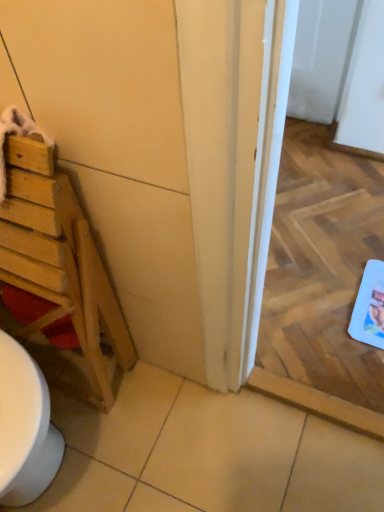
Image resolution: width=384 pixels, height=512 pixels. What do you see at coordinates (57, 265) in the screenshot? I see `wooden ladder at left` at bounding box center [57, 265].

The image size is (384, 512). Describe the element at coordinates (318, 402) in the screenshot. I see `white glossy screen door at center` at that location.

The width and height of the screenshot is (384, 512). Describe the element at coordinates (157, 156) in the screenshot. I see `wooden door at left` at that location.

The height and width of the screenshot is (512, 384). What are the coordinates of `wooden ladder at left` in the screenshot? It's located at (57, 265).

From the picture: Is white glossy screen door at center to the right of wooden door at left from the viewer's perspective?

Yes, white glossy screen door at center is to the right of wooden door at left.

Which of these two, white glossy screen door at center or wooden door at left, stands shorter?

Standing shorter between the two is white glossy screen door at center.

From the image's perspective, is white glossy screen door at center on top of wooden door at left?

Indeed, from the image's perspective, white glossy screen door at center is shown above wooden door at left.

Identify the location of door located below the white glossy screen door at center (from the image's perspective). (157, 156).

From a real-world perspective, does wooden door at left sit lower than wooden ladder at left?

No, from a real-world perspective, wooden door at left is not below wooden ladder at left.

What are the coordinates of `furniture on the left side of wooden door at left` in the screenshot? It's located at (57, 265).

How many degrees apart are the facing directions of wooden door at left and wooden ladder at left?

The angle between the facing direction of wooden door at left and the facing direction of wooden ladder at left is 90.3 degrees.

From the image's perspective, is wooden door at left over white glossy screen door at center?

No, from the image's perspective, wooden door at left is not on top of white glossy screen door at center.

Which of these two, wooden door at left or white glossy screen door at center, stands taller?

Standing taller between the two is wooden door at left.

Where is `door on the left of white glossy screen door at center`? door on the left of white glossy screen door at center is located at coordinates (157, 156).

Consider the image. From a real-world perspective, which object stands above the other?

From a 3D spatial view, wooden door at left is above.

Is point (336, 407) positioned before point (44, 224)?

No, it is not.

Considering the relative positions of white glossy screen door at center and wooden ladder at left in the image provided, is white glossy screen door at center to the left of wooden ladder at left from the viewer's perspective?

In fact, white glossy screen door at center is to the right of wooden ladder at left.

Considering the relative sizes of white glossy screen door at center and wooden ladder at left in the image provided, is white glossy screen door at center bigger than wooden ladder at left?

No, white glossy screen door at center is not bigger than wooden ladder at left.

Considering the positions of objects white glossy screen door at center and wooden ladder at left in the image provided, who is in front, white glossy screen door at center or wooden ladder at left?

wooden ladder at left is in front.

Who is smaller, wooden ladder at left or white glossy screen door at center?

white glossy screen door at center is smaller.

Is wooden ladder at left surrounding white glossy screen door at center?

Actually, white glossy screen door at center is outside wooden ladder at left.

Considering the sizes of objects wooden ladder at left and white glossy screen door at center in the image provided, who is wider, wooden ladder at left or white glossy screen door at center?

With larger width is white glossy screen door at center.

Is wooden ladder at left far away from white glossy screen door at center?

No, there isn't a large distance between wooden ladder at left and white glossy screen door at center.

Considering the relative sizes of wooden ladder at left and wooden door at left in the image provided, is wooden ladder at left taller than wooden door at left?

Answer: In fact, wooden ladder at left may be shorter than wooden door at left.

Is wooden ladder at left surrounding wooden door at left?

No, wooden door at left is not surrounded by wooden ladder at left.

Is wooden ladder at left touching wooden door at left?

No, wooden ladder at left is not with wooden door at left.

Considering the sizes of wooden ladder at left and wooden door at left in the image, is wooden ladder at left wider or thinner than wooden door at left?

wooden ladder at left is wider than wooden door at left.

Identify the location of screen door below the wooden door at left (from a real-world perspective). The image size is (384, 512). (318, 402).

What are the coordinates of `door lying on the right of wooden ladder at left` in the screenshot? It's located at (157, 156).

Based on their spatial positions, is white glossy screen door at center or wooden ladder at left further from wooden door at left?

Among the two, white glossy screen door at center is located further to wooden door at left.

When comparing their distances from wooden ladder at left, does white glossy screen door at center or wooden door at left seem further?

white glossy screen door at center lies further to wooden ladder at left than the other object.

From the image, which object appears to be nearer to white glossy screen door at center, wooden ladder at left or wooden door at left?

The object closer to white glossy screen door at center is wooden door at left.

Estimate the real-world distances between objects in this image. Which object is closer to wooden ladder at left, wooden door at left or white glossy screen door at center?

wooden door at left is positioned closer to the anchor wooden ladder at left.

Looking at this image, from the image, which object appears to be nearer to white glossy screen door at center, wooden door at left or wooden ladder at left?

The object closer to white glossy screen door at center is wooden door at left.

When comparing their distances from wooden door at left, does wooden ladder at left or white glossy screen door at center seem closer?

wooden ladder at left is closer to wooden door at left.

You are a GUI agent. You are given a task and a screenshot of the screen. Output one action in this format:
    pyautogui.click(x=<x>, y=<y>)
    Task: Click on the door between wooden ladder at left and white glossy screen door at center in the horizontal direction
    The height and width of the screenshot is (512, 384).
    Given the screenshot: What is the action you would take?
    pyautogui.click(x=157, y=156)